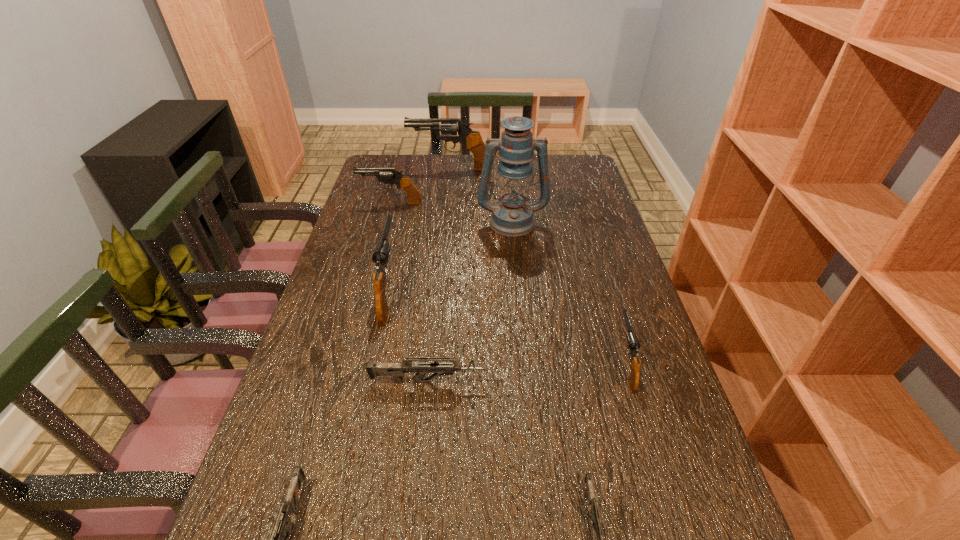
Locate an element on the screen. This screenshot has width=960, height=540. the third closest grey gun to the second tallest object is located at coordinates (595, 517).

You are a GUI agent. You are given a task and a screenshot of the screen. Output one action in this format:
    pyautogui.click(x=<x>, y=<y>)
    Task: Click on the closest grey gun to the shortest gun
    The width and height of the screenshot is (960, 540).
    Given the screenshot: What is the action you would take?
    pyautogui.click(x=396, y=370)